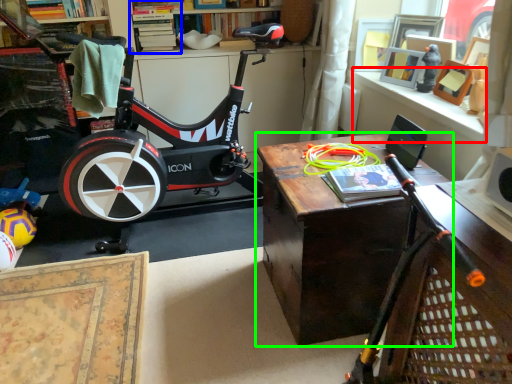
Question: Which object is positioned closest to window sill (highlighted by a red box)? Select from shelf (highlighted by a blue box) and table (highlighted by a green box).

Choices:
 (A) shelf
 (B) table

Answer: (B)